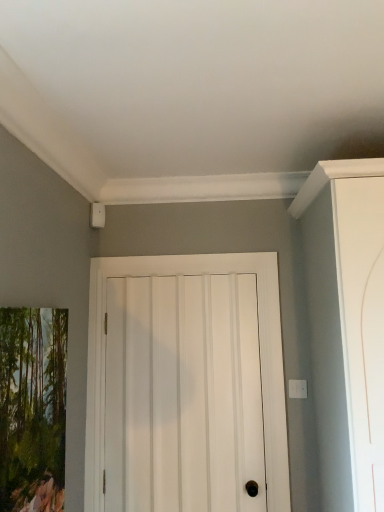
Find the location of a particular element. This screenshot has height=512, width=384. white matte door at center is located at coordinates (261, 356).

Describe the element at coordinates (261, 356) in the screenshot. I see `white matte door at center` at that location.

From the picture: In order to face white matte door at center, should I rotate leftwards or rightwards?

Rotate left and turn 1.864 degrees.

This screenshot has height=512, width=384. What do you see at coordinates (32, 408) in the screenshot?
I see `matte wooden picture frame at left` at bounding box center [32, 408].

This screenshot has width=384, height=512. Identify the location of matte wooden picture frame at left. (32, 408).

Locate an element on the screen. This screenshot has width=384, height=512. white matte door at center is located at coordinates (261, 356).

Considering the relative positions of matte wooden picture frame at left and white matte door at center in the image provided, is matte wooden picture frame at left to the right of white matte door at center from the viewer's perspective?

In fact, matte wooden picture frame at left is to the left of white matte door at center.

Is the depth of matte wooden picture frame at left greater than that of white matte door at center?

No, matte wooden picture frame at left is closer to the camera.

Does point (61, 310) come in front of point (268, 330)?

Yes, it is in front of point (268, 330).

From the image's perspective, does matte wooden picture frame at left appear lower than white matte door at center?

No, from the image's perspective, matte wooden picture frame at left is not below white matte door at center.

From a real-world perspective, is matte wooden picture frame at left positioned over white matte door at center based on gravity?

Yes, from a real-world perspective, matte wooden picture frame at left is over white matte door at center

Which object is thinner, matte wooden picture frame at left or white matte door at center?

With smaller width is white matte door at center.

Considering the relative sizes of matte wooden picture frame at left and white matte door at center in the image provided, is matte wooden picture frame at left shorter than white matte door at center?

Yes.

Looking at this image, who is bigger, matte wooden picture frame at left or white matte door at center?

white matte door at center is bigger.

Based on the photo, do you think matte wooden picture frame at left is within white matte door at center, or outside of it?

matte wooden picture frame at left is outside white matte door at center.

Is matte wooden picture frame at left touching white matte door at center?

matte wooden picture frame at left is not next to white matte door at center, and they're not touching.

Is matte wooden picture frame at left positioned with its back to white matte door at center?

No, white matte door at center is not at the back of matte wooden picture frame at left.

Can you tell me how much matte wooden picture frame at left and white matte door at center differ in facing direction?

The facing directions of matte wooden picture frame at left and white matte door at center are 90 degrees apart.

The image size is (384, 512). I want to click on picture frame above the white matte door at center (from a real-world perspective), so click(32, 408).

Can you confirm if white matte door at center is positioned to the right of matte wooden picture frame at left?

Correct, you'll find white matte door at center to the right of matte wooden picture frame at left.

Which is in front, white matte door at center or matte wooden picture frame at left?

matte wooden picture frame at left.

Considering the positions of point (159, 272) and point (32, 348), is point (159, 272) closer or farther from the camera than point (32, 348)?

Point (159, 272).

From the image's perspective, between white matte door at center and matte wooden picture frame at left, which one is located above?

matte wooden picture frame at left, from the image's perspective.

From a real-world perspective, does white matte door at center sit lower than matte wooden picture frame at left?

Yes, from a real-world perspective, white matte door at center is under matte wooden picture frame at left.

Consider the image. Considering the sizes of objects white matte door at center and matte wooden picture frame at left in the image provided, who is thinner, white matte door at center or matte wooden picture frame at left?

white matte door at center.

Is white matte door at center taller than matte wooden picture frame at left?

Yes, white matte door at center is taller than matte wooden picture frame at left.

Between white matte door at center and matte wooden picture frame at left, which one has larger size?

Bigger between the two is white matte door at center.

Which is correct: white matte door at center is inside matte wooden picture frame at left, or outside of it?

white matte door at center is spatially situated outside matte wooden picture frame at left.

Is there a large distance between white matte door at center and matte wooden picture frame at left?

No, white matte door at center is in close proximity to matte wooden picture frame at left.

Could you tell me if white matte door at center is turned towards matte wooden picture frame at left?

Yes, white matte door at center is oriented towards matte wooden picture frame at left.

This screenshot has height=512, width=384. Identify the location of door below the matte wooden picture frame at left (from a real-world perspective). (261, 356).

Where is `picture frame above the white matte door at center (from the image's perspective)`? The image size is (384, 512). picture frame above the white matte door at center (from the image's perspective) is located at coordinates (32, 408).

The height and width of the screenshot is (512, 384). Find the location of `door that appears below the matte wooden picture frame at left (from the image's perspective)`. door that appears below the matte wooden picture frame at left (from the image's perspective) is located at coordinates coord(261,356).